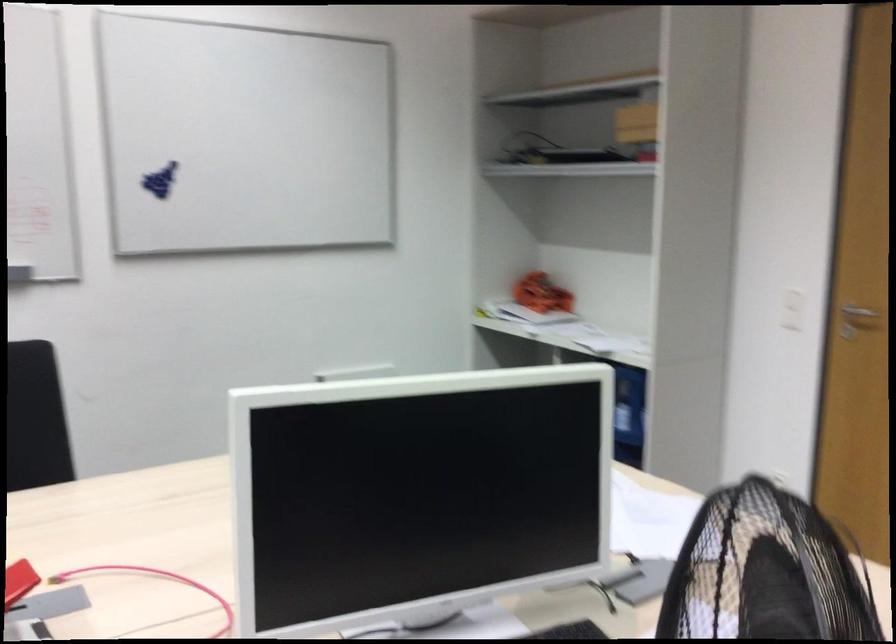
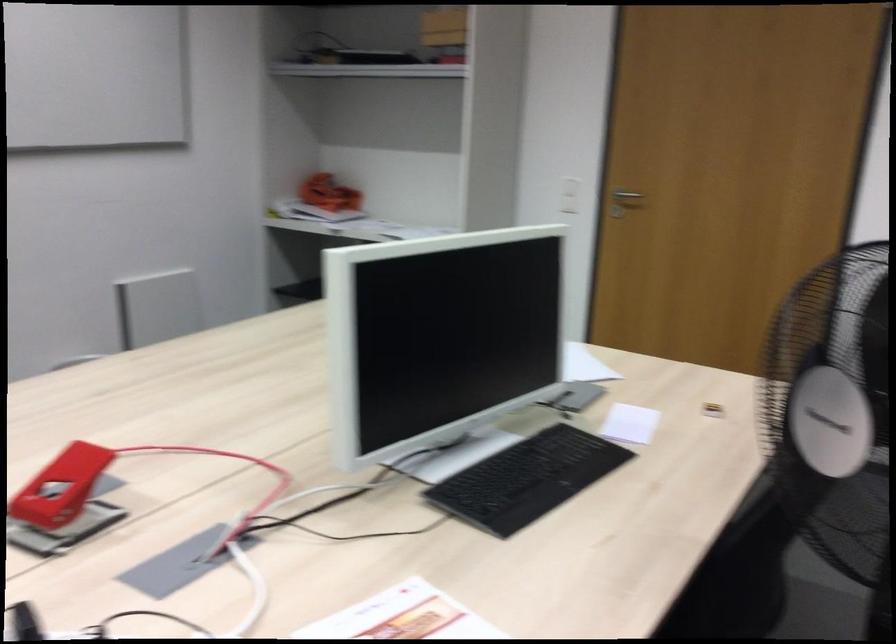
The point at (643, 124) is marked in the first image. Where is the corresponding point in the second image?

(444, 26)